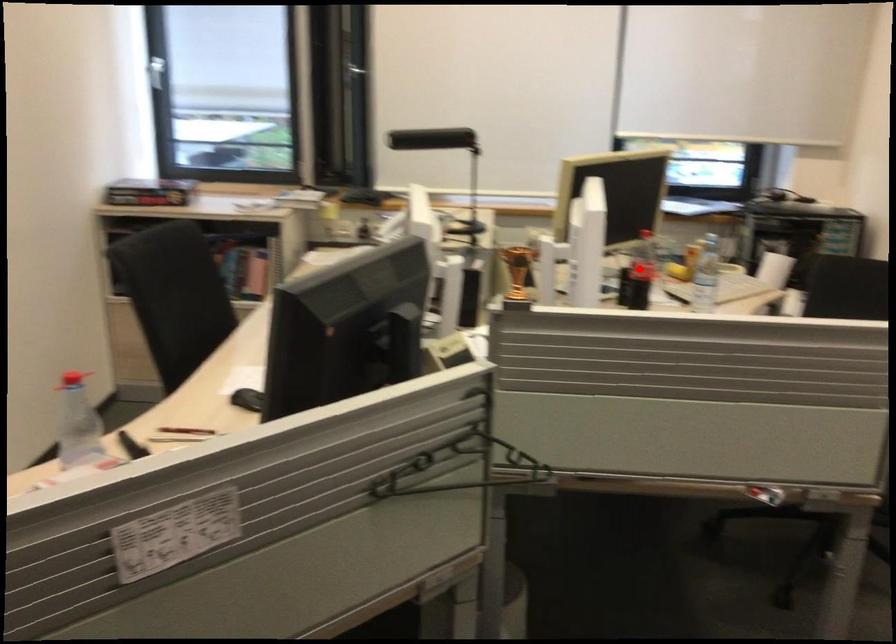
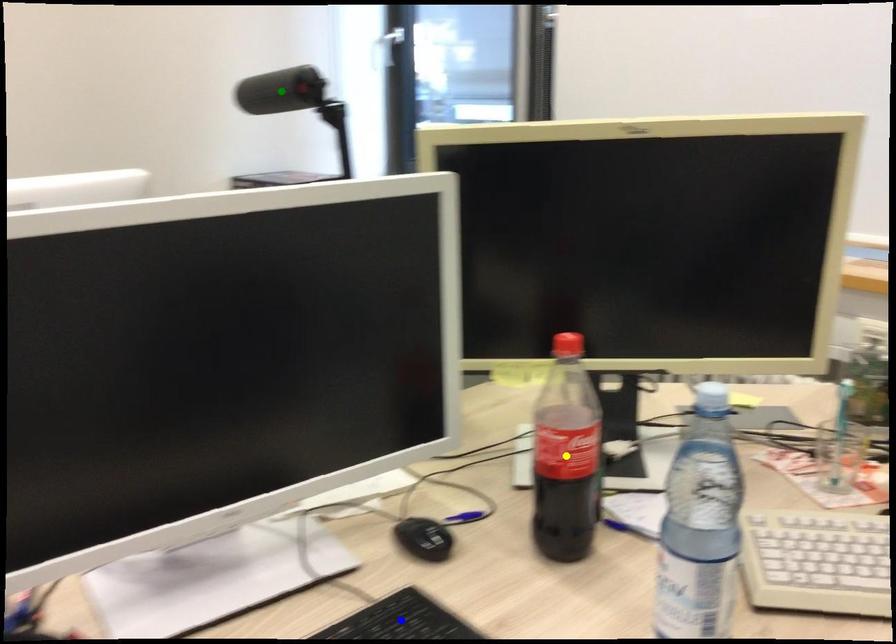
Question: I am providing you with two images of the same scene from different viewpoints. A red point is marked on the first image. You are given multiple points on the second image. Which point in image 2 is actually the same real-world point as the red point in image 1?

Choices:
 (A) blue point
 (B) yellow point
 (C) green point

Answer: (B)